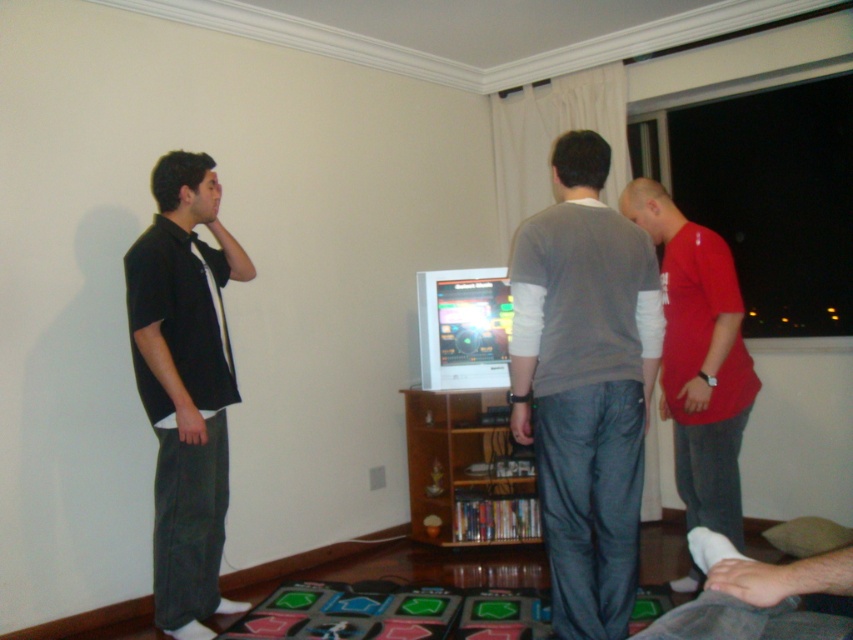
Question: Which point is farther to the camera?

Choices:
 (A) tap(566, 486)
 (B) tap(699, 467)
 (C) tap(141, 332)

Answer: (B)

Question: Does gray cotton shirt at center have a lesser width compared to black cotton shirt at left?

Choices:
 (A) yes
 (B) no

Answer: (B)

Question: Where is gray cotton shirt at center located in relation to red matte t-shirt at center in the image?

Choices:
 (A) left
 (B) right

Answer: (A)

Question: Among these points, which one is nearest to the camera?

Choices:
 (A) (177, 602)
 (B) (726, 424)

Answer: (B)

Question: Which object is farther from the camera taking this photo?

Choices:
 (A) black cotton shirt at left
 (B) red matte t-shirt at center
 (C) gray cotton shirt at center

Answer: (B)

Question: Is the position of gray cotton shirt at center less distant than that of black cotton shirt at left?

Choices:
 (A) no
 (B) yes

Answer: (B)